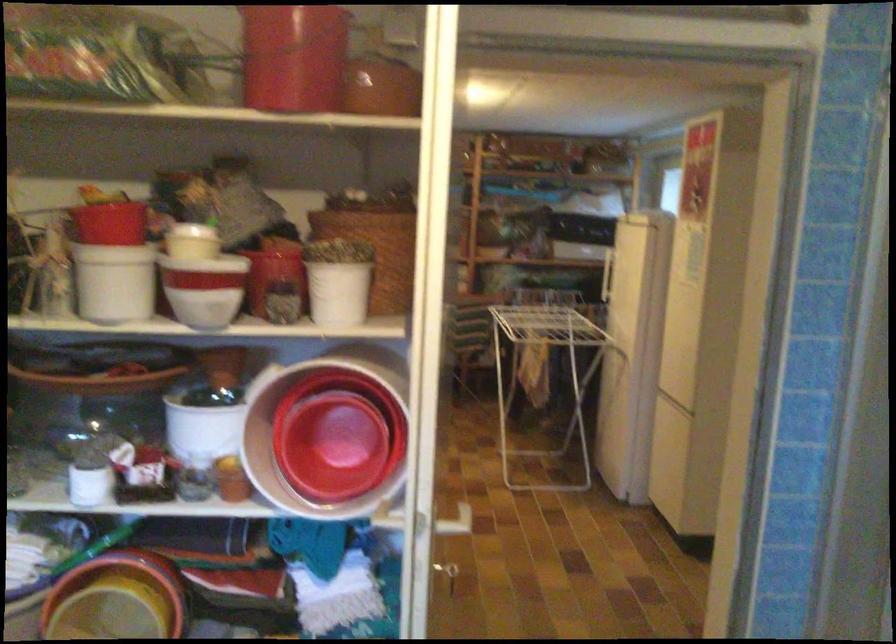
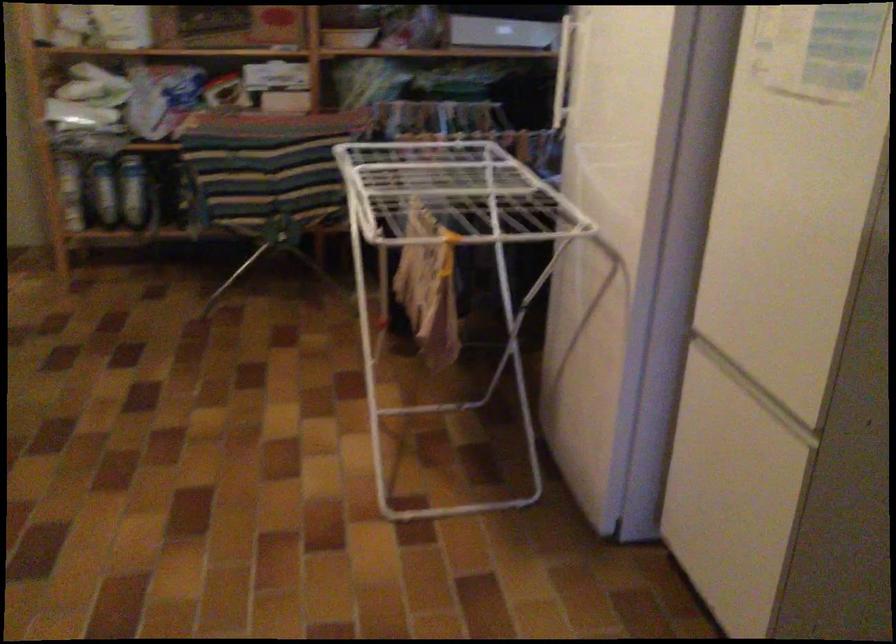
In the second image, find the point that corresponds to (532,337) in the first image.

(450, 258)